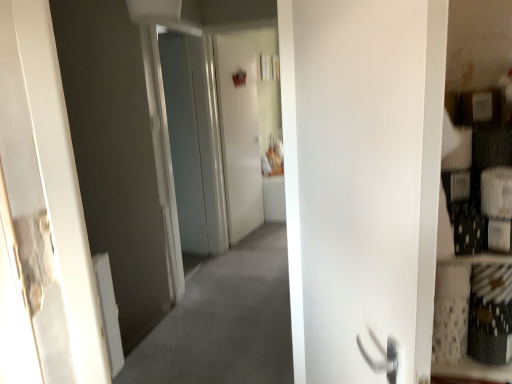
Question: Can you confirm if white matte door at right is taller than white glossy door at center, the 2th screen door viewed from the left?

Choices:
 (A) no
 (B) yes

Answer: (A)

Question: Can you confirm if white matte door at right is wider than white glossy door at center, which is counted as the 1th screen door, starting from the right?

Choices:
 (A) yes
 (B) no

Answer: (A)

Question: Are white matte door at right and white glossy door at center, the 2th screen door viewed from the left, beside each other?

Choices:
 (A) yes
 (B) no

Answer: (B)

Question: Is white matte door at right positioned behind white glossy door at center, the 2th screen door viewed from the left?

Choices:
 (A) no
 (B) yes

Answer: (A)

Question: Is white matte door at right oriented away from white glossy door at center, which is counted as the 1th screen door, starting from the right?

Choices:
 (A) yes
 (B) no

Answer: (B)

Question: Considering the positions of transparent glass door at center, arranged as the 1th screen door when viewed from the left, and white matte door at right in the image, is transparent glass door at center, arranged as the 1th screen door when viewed from the left, bigger or smaller than white matte door at right?

Choices:
 (A) big
 (B) small

Answer: (A)

Question: Does point (184, 210) appear closer or farther from the camera than point (316, 1)?

Choices:
 (A) closer
 (B) farther

Answer: (B)

Question: Is transparent glass door at center, which appears as the second screen door when viewed from the right, situated inside white matte door at right or outside?

Choices:
 (A) outside
 (B) inside

Answer: (A)

Question: Looking at their shapes, would you say transparent glass door at center, which appears as the second screen door when viewed from the right, is wider or thinner than white matte door at right?

Choices:
 (A) thin
 (B) wide

Answer: (A)

Question: In the image, is white glossy door at center, the 2th screen door viewed from the left, on the left side or the right side of transparent glass door at center, which appears as the second screen door when viewed from the right?

Choices:
 (A) left
 (B) right

Answer: (B)

Question: Considering the positions of white glossy door at center, the 2th screen door viewed from the left, and transparent glass door at center, arranged as the 1th screen door when viewed from the left, in the image, is white glossy door at center, the 2th screen door viewed from the left, bigger or smaller than transparent glass door at center, arranged as the 1th screen door when viewed from the left,?

Choices:
 (A) big
 (B) small

Answer: (B)

Question: In terms of height, does white glossy door at center, the 2th screen door viewed from the left, look taller or shorter compared to transparent glass door at center, which appears as the second screen door when viewed from the right?

Choices:
 (A) tall
 (B) short

Answer: (B)

Question: From a real-world perspective, is white glossy door at center, the 2th screen door viewed from the left, positioned above or below transparent glass door at center, which appears as the second screen door when viewed from the right?

Choices:
 (A) above
 (B) below

Answer: (B)

Question: Is white matte door at right inside the boundaries of transparent glass door at center, which appears as the second screen door when viewed from the right, or outside?

Choices:
 (A) inside
 (B) outside

Answer: (B)

Question: In the image, is white matte door at right positioned in front of or behind transparent glass door at center, arranged as the 1th screen door when viewed from the left?

Choices:
 (A) behind
 (B) front

Answer: (B)